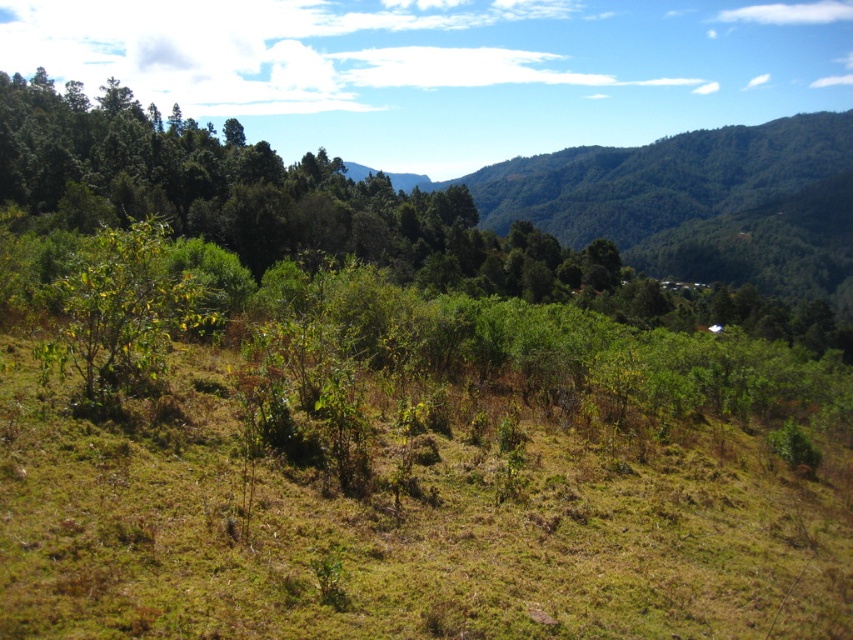
Question: Which point is closer to the camera?

Choices:
 (A) green leafy shrub at center
 (B) green grassy at center

Answer: (B)

Question: In this image, where is green grassy at center located relative to green leafy shrub at center?

Choices:
 (A) below
 (B) above

Answer: (A)

Question: Can you confirm if green grassy at center is positioned below green leafy shrub at center?

Choices:
 (A) yes
 (B) no

Answer: (A)

Question: Does green grassy at center have a lesser width compared to green leafy shrub at center?

Choices:
 (A) yes
 (B) no

Answer: (A)

Question: Which point is closer to the camera taking this photo?

Choices:
 (A) (84, 259)
 (B) (373, 557)

Answer: (B)